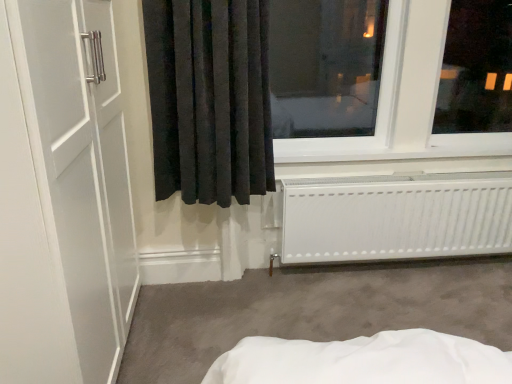
Where is `free space above white plastic window sill at lower center (from a real-world perspective)`? The height and width of the screenshot is (384, 512). free space above white plastic window sill at lower center (from a real-world perspective) is located at coordinates (399, 141).